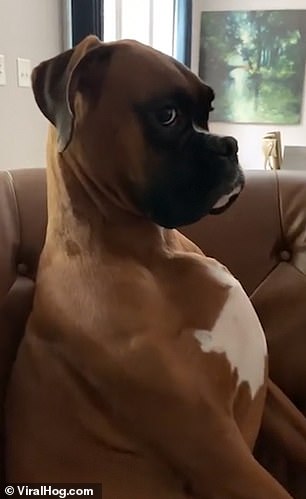
Image resolution: width=306 pixels, height=499 pixels. Identify the location of chest. (254, 334).